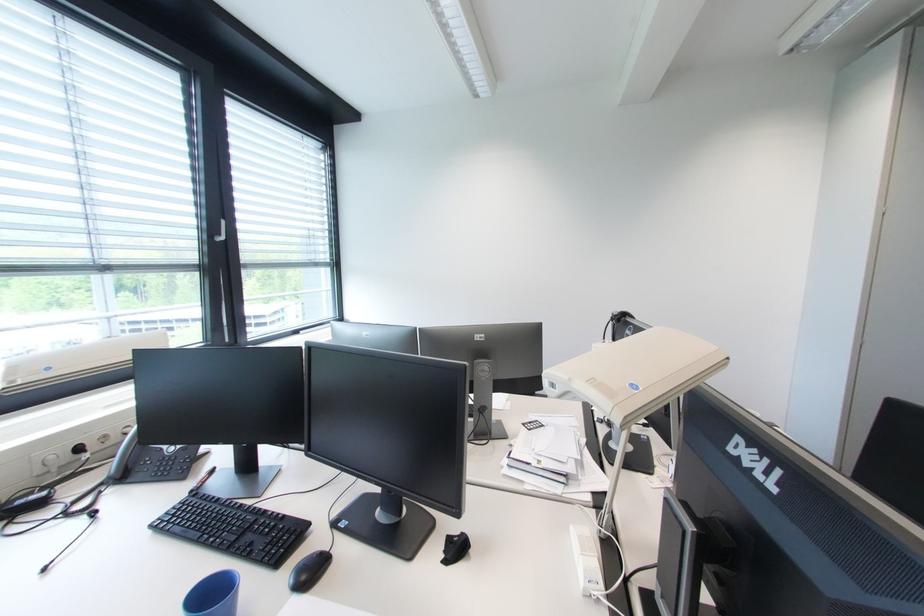
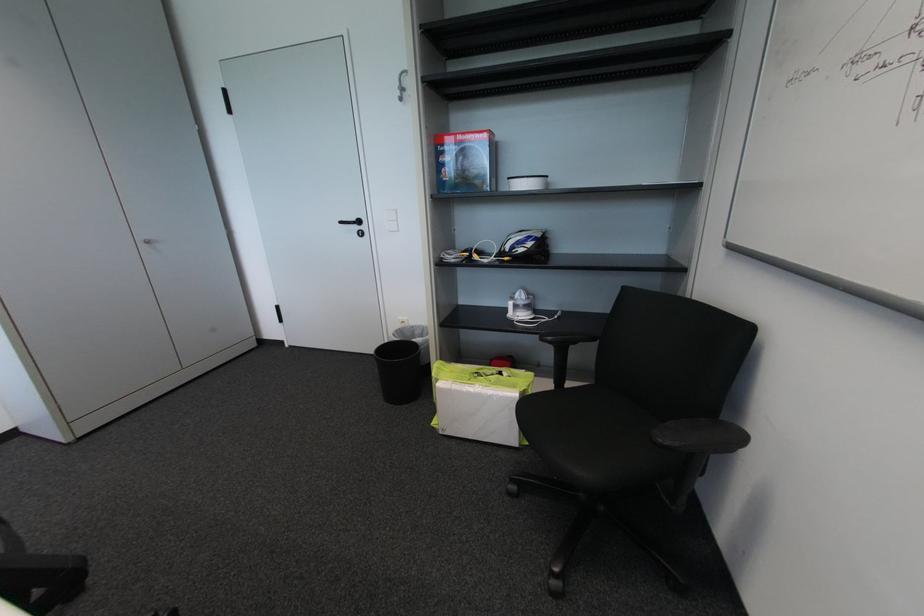
Based on the continuous images, in which direction is the camera rotating?

The camera rotated toward right-down.